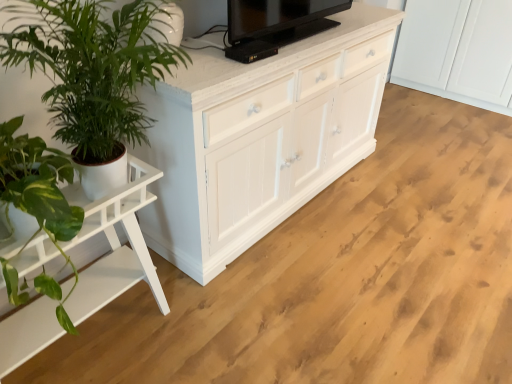
You are a GUI agent. You are given a task and a screenshot of the screen. Output one action in this format:
    pyautogui.click(x=<x>, y=<y>)
    Task: Click on the vacant area situated below white wood table at left (from a real-world perspective)
    The image size is (512, 384).
    Given the screenshot: What is the action you would take?
    pyautogui.click(x=97, y=336)